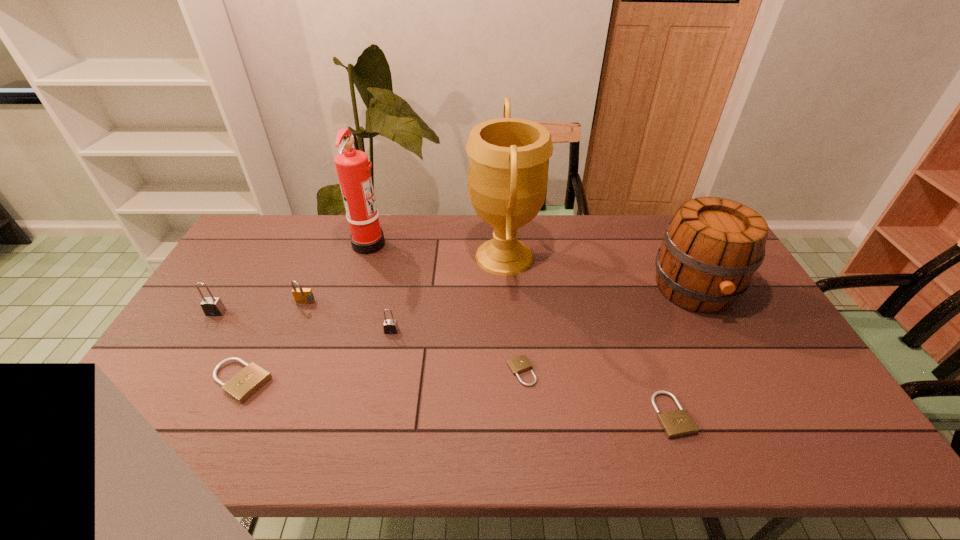
The height and width of the screenshot is (540, 960). Find the location of `vacant area that satisfies the following two spatial constraints: 1. on the back side of the smallest beige padlock; 2. at the nozzle of the red fire extinguisher`. vacant area that satisfies the following two spatial constraints: 1. on the back side of the smallest beige padlock; 2. at the nozzle of the red fire extinguisher is located at coordinates (511, 243).

Where is `blank area in the image that satisfies the following two spatial constraints: 1. at the nozzle of the sixth object from right to left; 2. on the right side of the second beige padlock from left to right`? blank area in the image that satisfies the following two spatial constraints: 1. at the nozzle of the sixth object from right to left; 2. on the right side of the second beige padlock from left to right is located at coordinates (330, 372).

The height and width of the screenshot is (540, 960). Identify the location of free point that satisfies the following two spatial constraints: 1. on the shackle of the second object from right to left; 2. on the right side of the nearer gray padlock. (375, 415).

I want to click on free location that satisfies the following two spatial constraints: 1. on the side with the combination dials of the second biggest beige padlock; 2. on the left side of the farthest padlock, so click(x=259, y=415).

In order to click on vacant space that satisfies the following two spatial constraints: 1. on the engravings side of the trophy; 2. on the right side of the second shortest padlock in this screenshot , I will do `click(515, 415)`.

Identify the location of vacant position in the image that satisfies the following two spatial constraints: 1. on the side with the combination dials of the smallest beige padlock; 2. on the right side of the farthest padlock. This screenshot has height=540, width=960. (277, 372).

The image size is (960, 540). I want to click on blank space that satisfies the following two spatial constraints: 1. at the nozzle of the second smallest beige padlock; 2. on the left side of the fire extinguisher, so click(317, 415).

Image resolution: width=960 pixels, height=540 pixels. Find the location of `vacant point that satisfies the following two spatial constraints: 1. on the shackle of the second padlock from right to left; 2. on the left side of the right gray padlock`. vacant point that satisfies the following two spatial constraints: 1. on the shackle of the second padlock from right to left; 2. on the left side of the right gray padlock is located at coordinates (383, 372).